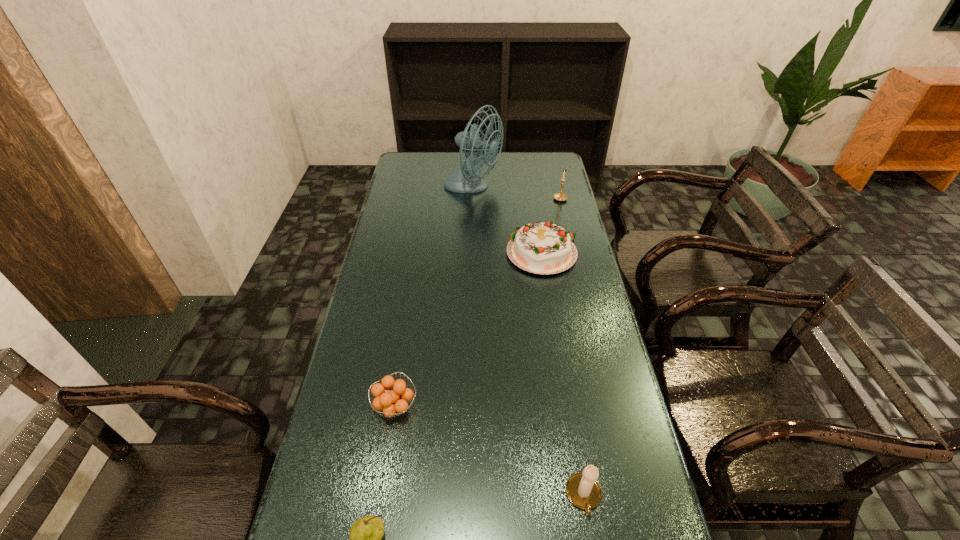
The image size is (960, 540). I want to click on vacant space in between the right candle holder and the tallest object, so click(x=516, y=194).

Locate an element on the screen. The image size is (960, 540). free space between the fourth farthest object and the right candle holder is located at coordinates (478, 303).

Where is `empty location between the right candle holder and the tallest object`? This screenshot has width=960, height=540. empty location between the right candle holder and the tallest object is located at coordinates (516, 194).

Locate an element on the screen. free space between the shortest object and the cake is located at coordinates (469, 330).

Point out which object is positioned as the fifth nearest to the pear. Please provide its 2D coordinates. Your answer should be formatted as a tuple, i.e. [(x, y)], where the tuple contains the x and y coordinates of a point satisfying the conditions above.

[(561, 196)]

Locate an element on the screen. This screenshot has height=540, width=960. object that can be found as the second closest to the right candle holder is located at coordinates (465, 179).

Where is `free space in the image that satisfies the following two spatial constraints: 1. in front of the cake to blow air; 2. on the left side of the tallest object`? free space in the image that satisfies the following two spatial constraints: 1. in front of the cake to blow air; 2. on the left side of the tallest object is located at coordinates (471, 253).